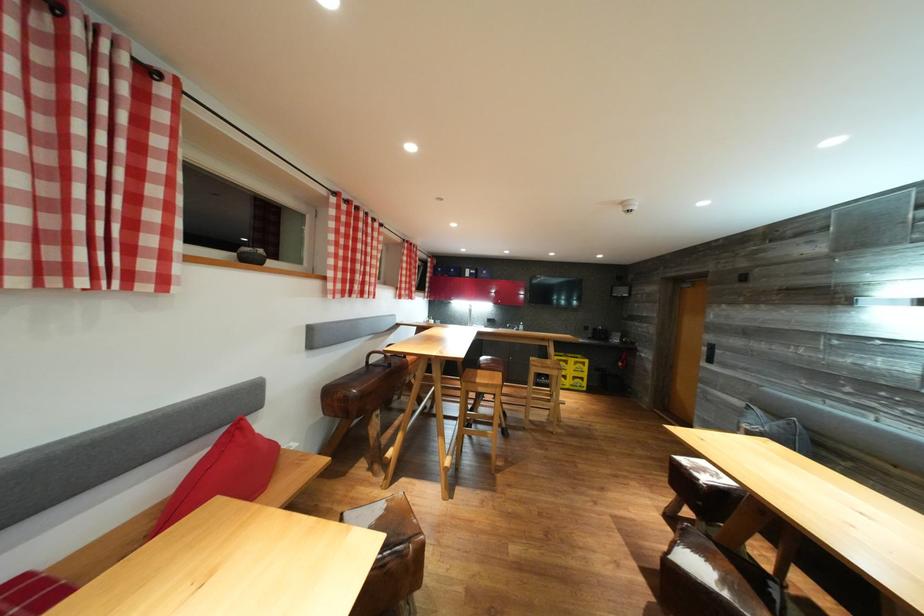
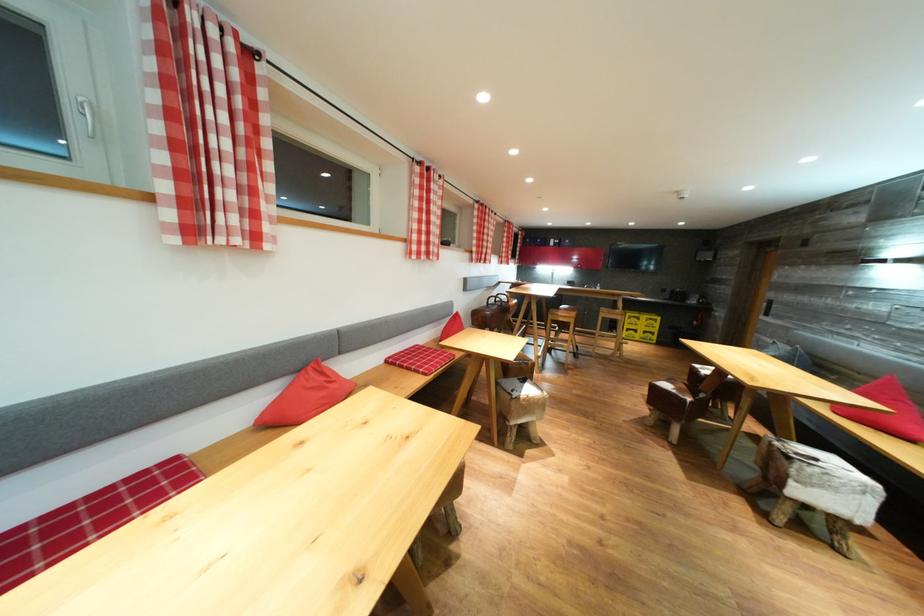
Find the pixel in the second image that matches the point at 578,366 in the first image.

(650, 323)